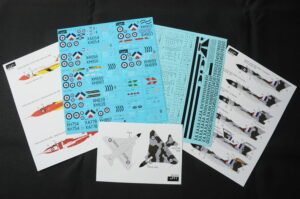
This screenshot has height=199, width=300. What are the coordinates of `white sheet` in the screenshot? It's located at (115, 177), (173, 130), (113, 127).